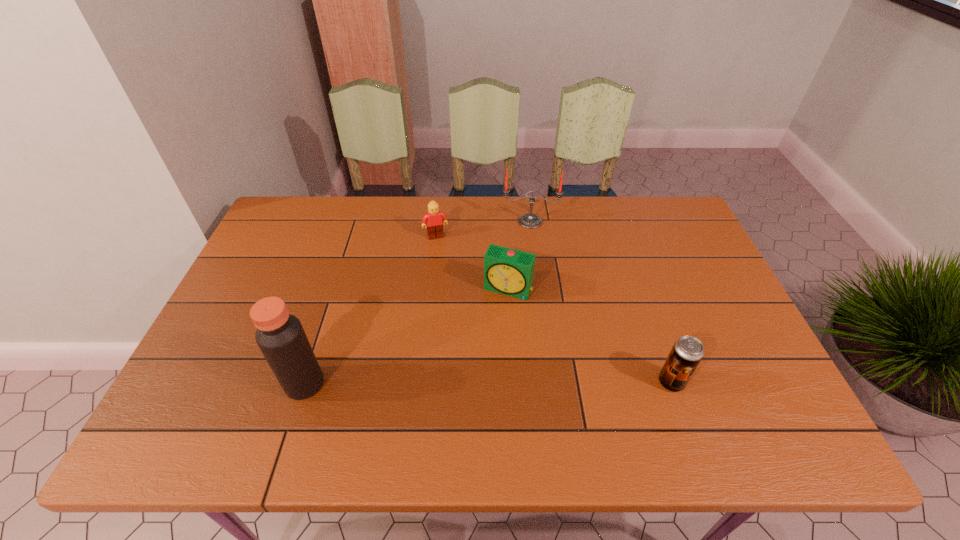
Find the location of a particular element. candle located in the far edge section of the desktop is located at coordinates (530, 221).

Where is `vinegar that is at the near edge`? Image resolution: width=960 pixels, height=540 pixels. vinegar that is at the near edge is located at coordinates (280, 336).

Locate an element on the screen. Image resolution: width=960 pixels, height=540 pixels. beer can positioned at the near edge is located at coordinates click(687, 351).

You are a GUI agent. You are given a task and a screenshot of the screen. Output one action in this format:
    pyautogui.click(x=<x>, y=<y>)
    Task: Click on the free point at the far edge
    
    Given the screenshot: What is the action you would take?
    pyautogui.click(x=467, y=235)

In the image, there is a desktop. Where is `vacant area at the near edge`? The height and width of the screenshot is (540, 960). vacant area at the near edge is located at coordinates (390, 377).

The image size is (960, 540). In order to click on vacant region at the left edge of the desktop in this screenshot , I will do `click(245, 366)`.

Where is `free space at the far left corner of the desktop`? free space at the far left corner of the desktop is located at coordinates (285, 214).

In the image, there is a desktop. Where is `free space at the far right corner`? free space at the far right corner is located at coordinates (680, 215).

Where is `empty location between the candle and the leftmost object`? The image size is (960, 540). empty location between the candle and the leftmost object is located at coordinates (418, 302).

Find the location of a particular element. The width and height of the screenshot is (960, 540). free point between the fourth shortest object and the second farthest object is located at coordinates (483, 229).